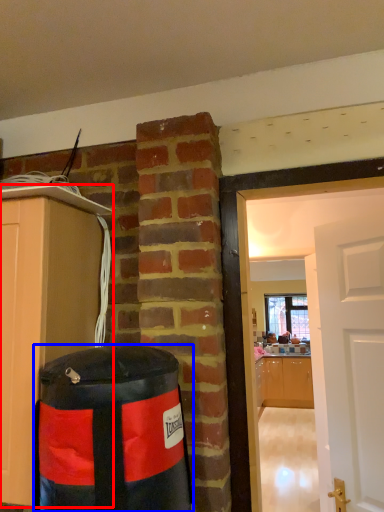
Question: Which point is closer to the camera, cabinetry (highlighted by a red box) or punching bag (highlighted by a blue box)?

Choices:
 (A) cabinetry
 (B) punching bag

Answer: (B)